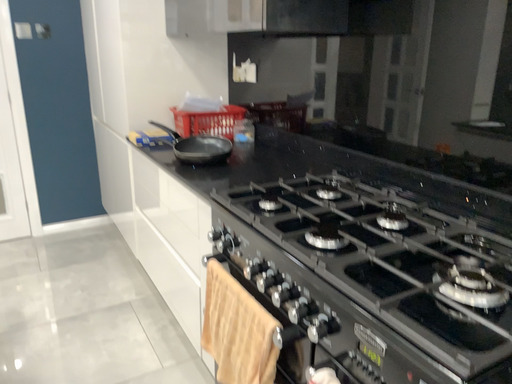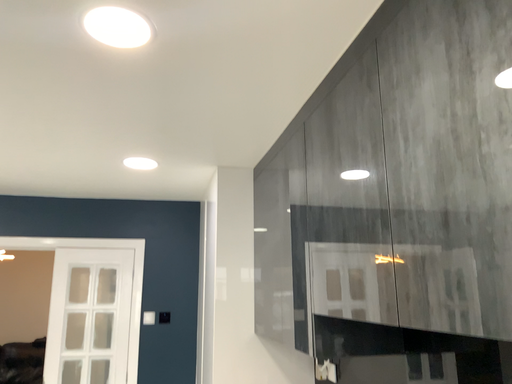
Question: How did the camera likely rotate when shooting the video?

Choices:
 (A) rotated right
 (B) rotated left

Answer: (B)